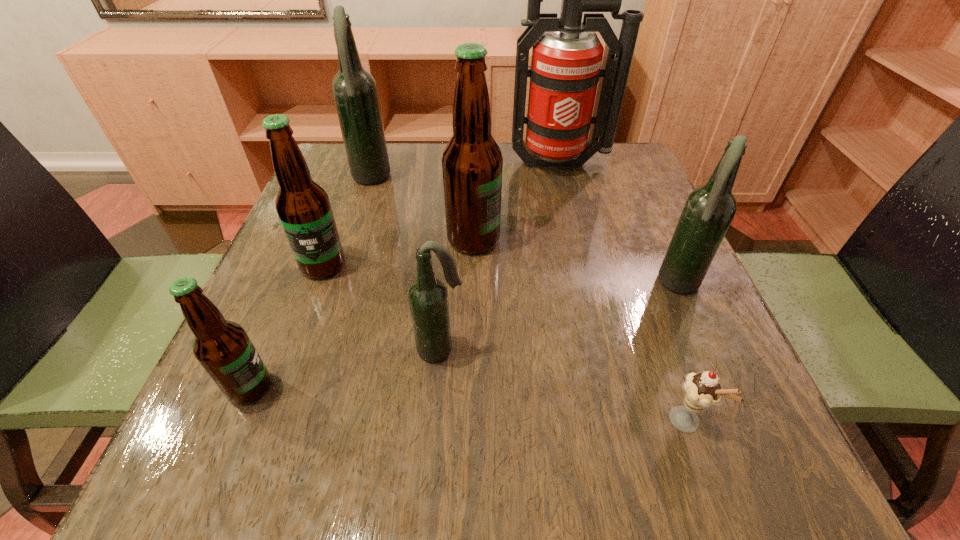
Locate an element on the screen. The height and width of the screenshot is (540, 960). the closest brown beer bottle to the nearest brown beer bottle is located at coordinates (303, 206).

Choose which brown beer bottle is the third nearest neighbor to the red fire extinguisher. Please provide its 2D coordinates. Your answer should be formatted as a tuple, i.e. [(x, y)], where the tuple contains the x and y coordinates of a point satisfying the conditions above.

[(223, 348)]

Locate an element on the screen. The image size is (960, 540). vacant space that satisfies the following two spatial constraints: 1. on the label of the third nearest object; 2. on the left side of the second biggest brown beer bottle is located at coordinates (293, 349).

At what (x,y) coordinates should I click in order to perform the action: click on free space that satisfies the following two spatial constraints: 1. on the label of the shortest object; 2. on the left side of the nearest brown beer bottle. Please return your answer as a coordinate pair (x, y). Looking at the image, I should click on (235, 422).

You are a GUI agent. You are given a task and a screenshot of the screen. Output one action in this format:
    pyautogui.click(x=<x>, y=<y>)
    Task: Click on the vacant space that satisfies the following two spatial constraints: 1. on the back side of the shortest object; 2. on the label of the nearest beer bottle
    This screenshot has width=960, height=540.
    Given the screenshot: What is the action you would take?
    pyautogui.click(x=673, y=387)

Where is `vacant area in the image that satisfies the following two spatial constraints: 1. on the back side of the second farthest dark beer bottle; 2. on the label of the rightmost brown beer bottle`? The width and height of the screenshot is (960, 540). vacant area in the image that satisfies the following two spatial constraints: 1. on the back side of the second farthest dark beer bottle; 2. on the label of the rightmost brown beer bottle is located at coordinates (660, 240).

The height and width of the screenshot is (540, 960). I want to click on blank space that satisfies the following two spatial constraints: 1. on the back side of the icecream; 2. on the label of the nearest brown beer bottle, so click(x=673, y=387).

Image resolution: width=960 pixels, height=540 pixels. I want to click on free space in the image that satisfies the following two spatial constraints: 1. on the label of the rightmost brown beer bottle; 2. on the back side of the rightmost beer bottle, so click(x=472, y=285).

You are a GUI agent. You are given a task and a screenshot of the screen. Output one action in this format:
    pyautogui.click(x=<x>, y=<y>)
    Task: Click on the vacant area in the image that satisfies the following two spatial constraints: 1. on the front label side of the red fire extinguisher; 2. on the right side of the rightmost beer bottle
    This screenshot has width=960, height=540.
    Given the screenshot: What is the action you would take?
    pyautogui.click(x=590, y=285)

Find the location of a particular element. vacant space that satisfies the following two spatial constraints: 1. on the back side of the shortest object; 2. on the label of the smallest brown beer bottle is located at coordinates (673, 387).